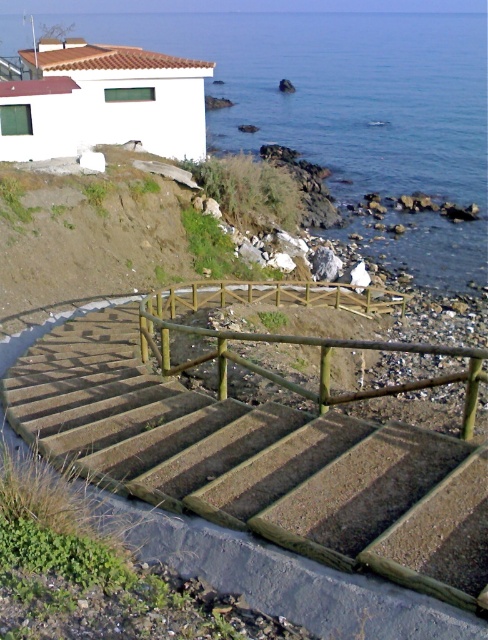
Question: Is concrete textured stairs at center thinner than wooden rail at center?

Choices:
 (A) yes
 (B) no

Answer: (A)

Question: Does blue water at upper center have a greater width compared to wooden rail at center?

Choices:
 (A) no
 (B) yes

Answer: (B)

Question: Can you confirm if blue water at upper center is smaller than wooden rail at center?

Choices:
 (A) yes
 (B) no

Answer: (B)

Question: Which point is closer to the camera taking this photo?

Choices:
 (A) (409, 154)
 (B) (337, 593)

Answer: (B)

Question: Which point appears farthest from the camera in this image?

Choices:
 (A) (480, 234)
 (B) (473, 424)

Answer: (A)

Question: Which point is farther to the camera?

Choices:
 (A) (331, 576)
 (B) (390, 348)

Answer: (B)